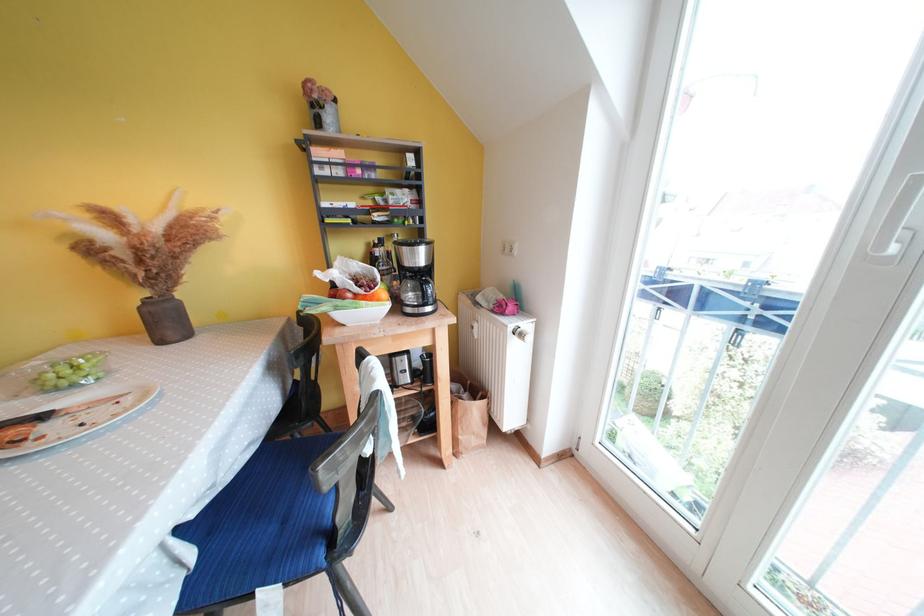
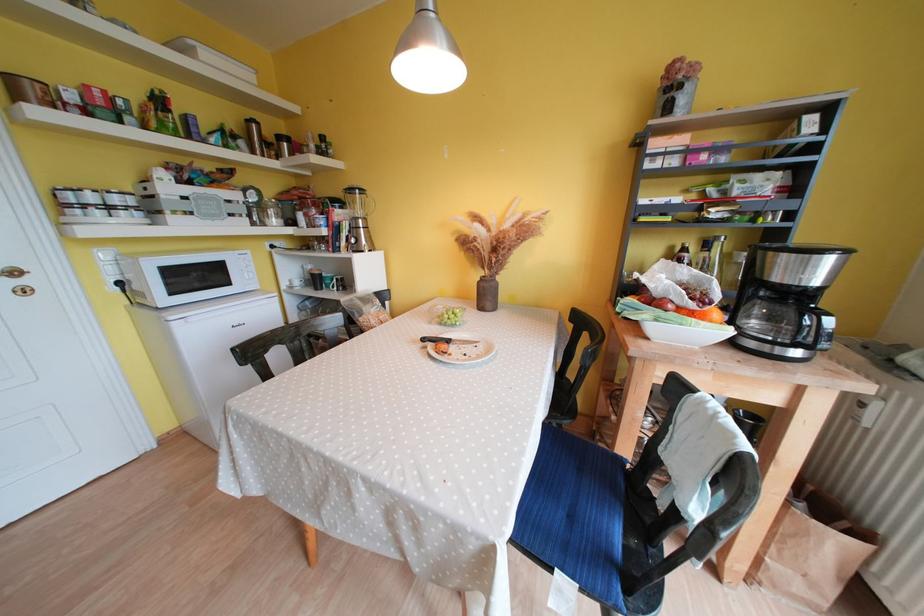
Question: The camera is either moving clockwise (left) or counter-clockwise (right) around the object. The first image is from the beginning of the video and the second image is from the end. Is the camera moving left or right when shooting the video?

Choices:
 (A) Left
 (B) Right

Answer: (B)